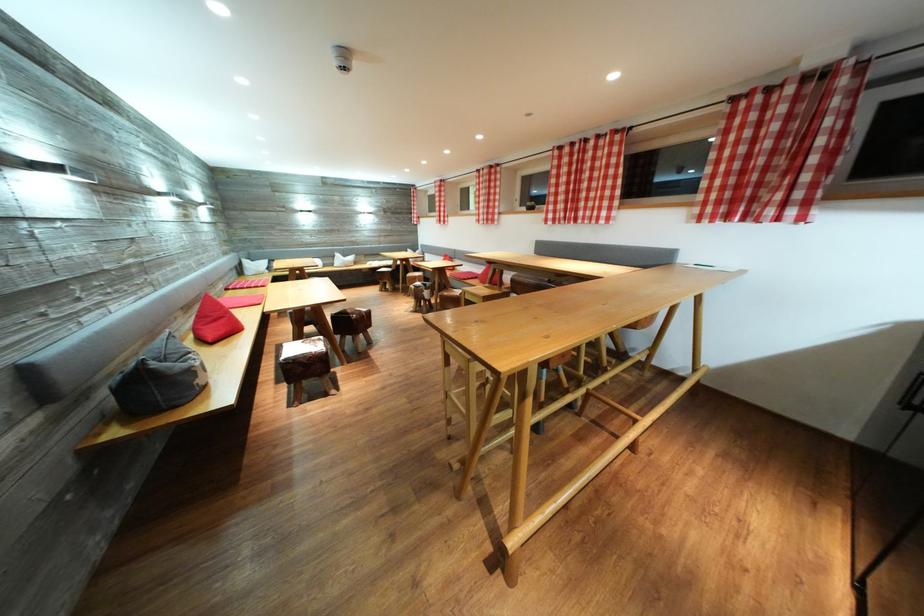
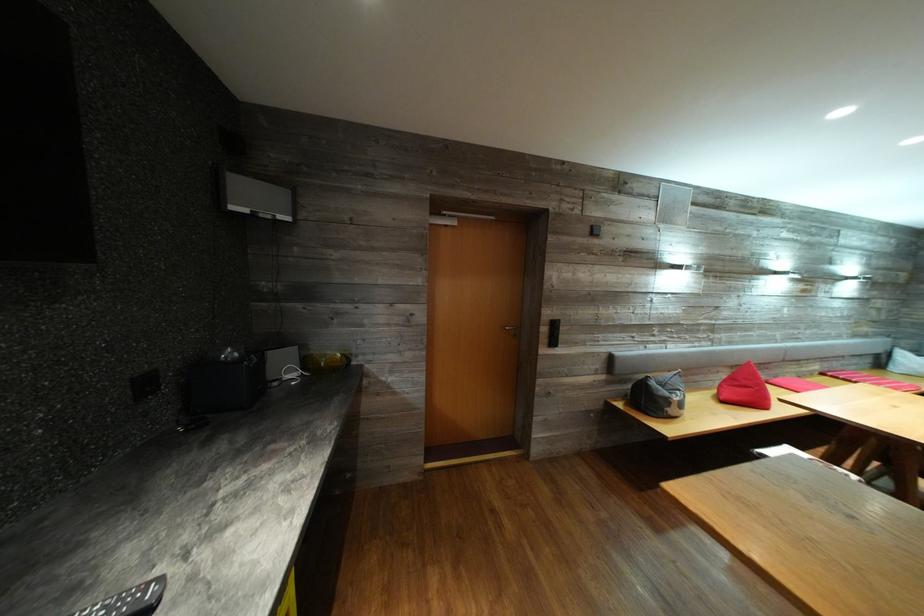
Question: The images are taken continuously from a first-person perspective. In which direction is your viewpoint rotating?

Choices:
 (A) Left
 (B) Right
 (C) Up
 (D) Down

Answer: (A)